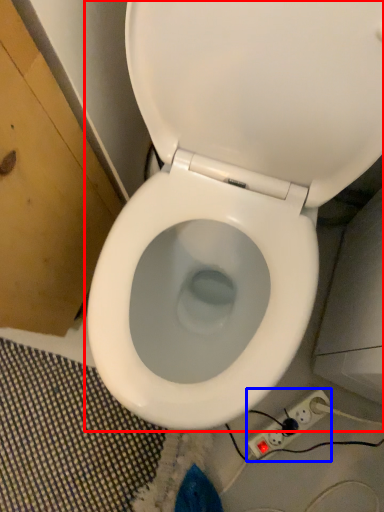
Question: Which point is further to the camera, toilet (highlighted by a red box) or electric outlet (highlighted by a blue box)?

Choices:
 (A) toilet
 (B) electric outlet

Answer: (B)